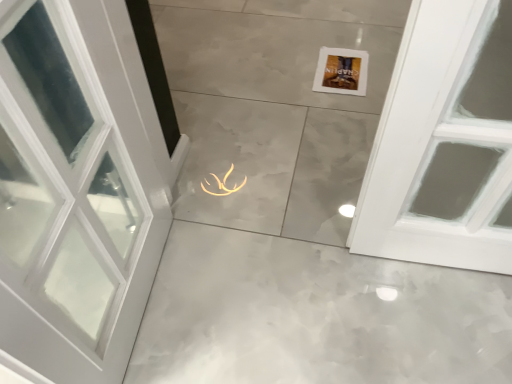
Describe the element at coordinates (341, 71) in the screenshot. I see `matte gold postcard at upper right` at that location.

You are a GUI agent. You are given a task and a screenshot of the screen. Output one action in this format:
    pyautogui.click(x=<x>, y=<y>)
    Task: Click on the matte gold postcard at upper right
    
    Given the screenshot: What is the action you would take?
    pyautogui.click(x=341, y=71)

What is the approximate width of matte gold postcard at upper right?

It is 11.38 inches.

Identify the location of matte gold postcard at upper right. (341, 71).